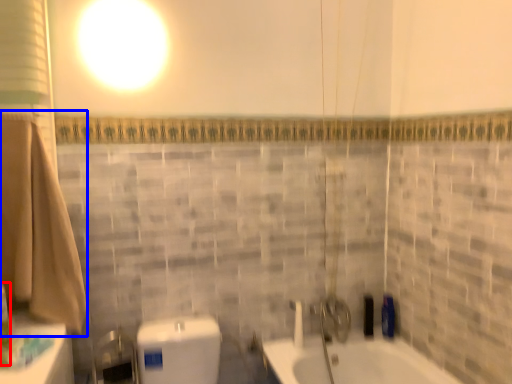
Question: Which of the following is the farthest to the observer, toiletry (highlighted by a red box) or bath towel (highlighted by a blue box)?

Choices:
 (A) toiletry
 (B) bath towel

Answer: (B)